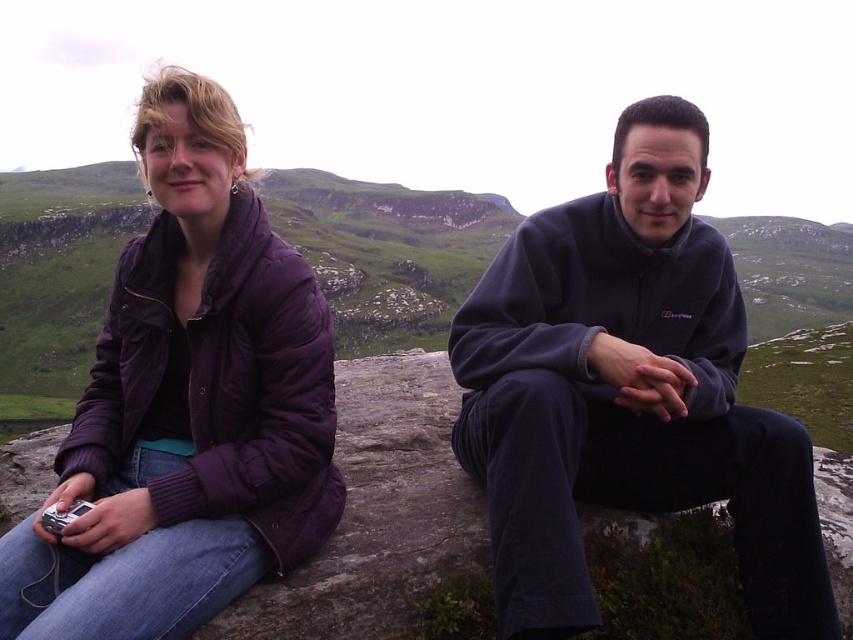
Question: Which point is closer to the camera?

Choices:
 (A) (70, 596)
 (B) (564, 608)

Answer: (A)

Question: Is dark gray fleece at center bigger than purple puffy jacket at left?

Choices:
 (A) no
 (B) yes

Answer: (B)

Question: Which of the following is the closest to the observer?

Choices:
 (A) dark gray fleece at center
 (B) purple puffy jacket at left

Answer: (B)

Question: Is dark gray fleece at center smaller than purple puffy jacket at left?

Choices:
 (A) yes
 (B) no

Answer: (B)

Question: Which of the following is the farthest from the observer?

Choices:
 (A) (704, 355)
 (B) (201, 298)

Answer: (A)

Question: Is dark gray fleece at center below purple puffy jacket at left?

Choices:
 (A) yes
 (B) no

Answer: (A)